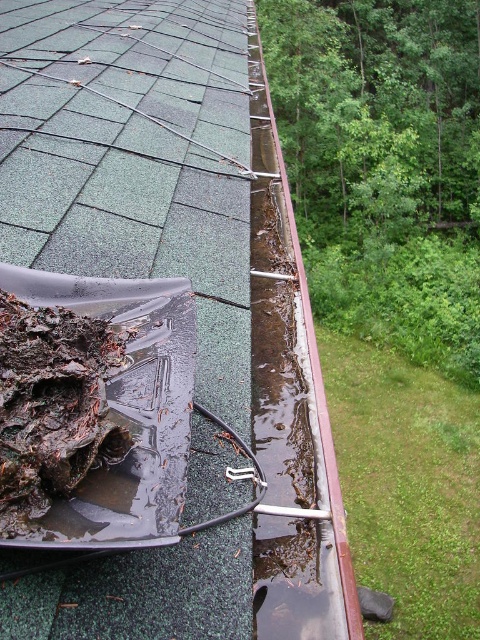
You are a maintenance worker assessing the roof. You notice the green shingles at upper left and the brown organic matter at lower left. Which object takes up more space in the image?

The green shingles at upper left is bigger than brown organic matter at lower left, so the green shingles at upper left takes up more space in the image.

You are a roofer assessing the roof. You notice the green shingles at upper left and the brown organic matter at lower left. Which object is closer to you from your elevated viewpoint?

The green shingles at upper left are closer to you because they are in front of the brown organic matter at lower left.

You are a roofer assessing the roof shown. You notice the green shingles at upper left and the brown organic matter at lower left. Which object is located higher up in the image?

The green shingles at upper left are positioned over the brown organic matter at lower left, so the green shingles at upper left are higher up.